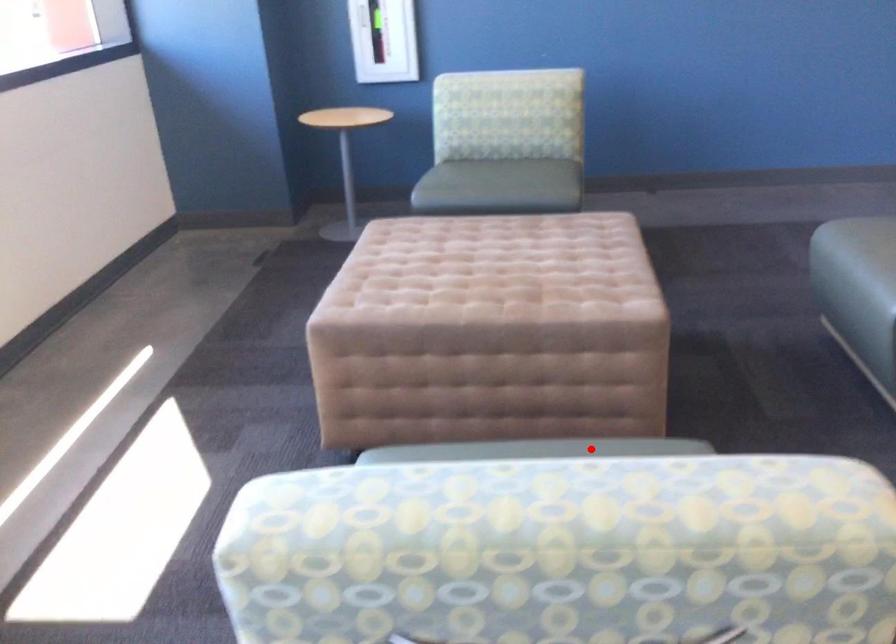
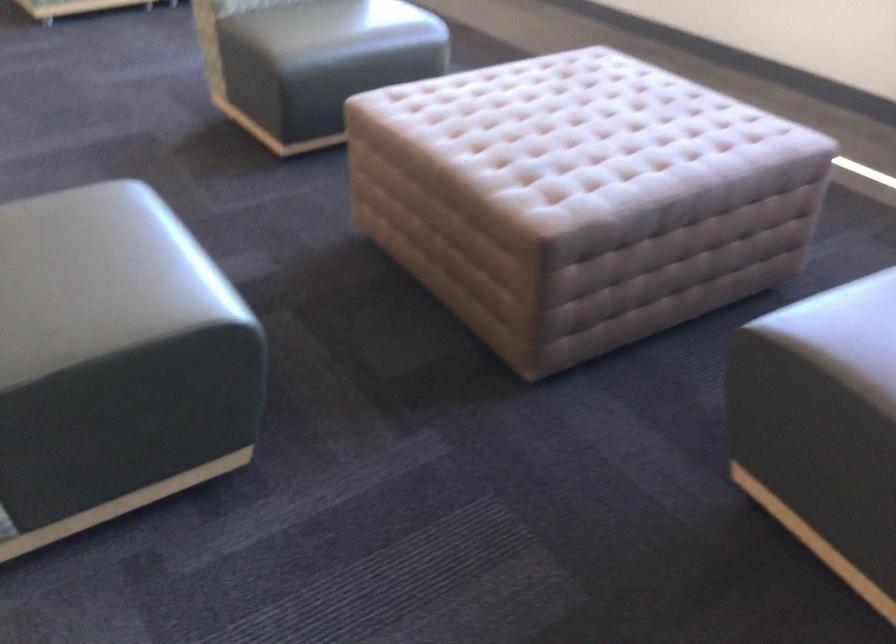
The point at the highlighted location is marked in the first image. Where is the corresponding point in the second image?

(334, 26)